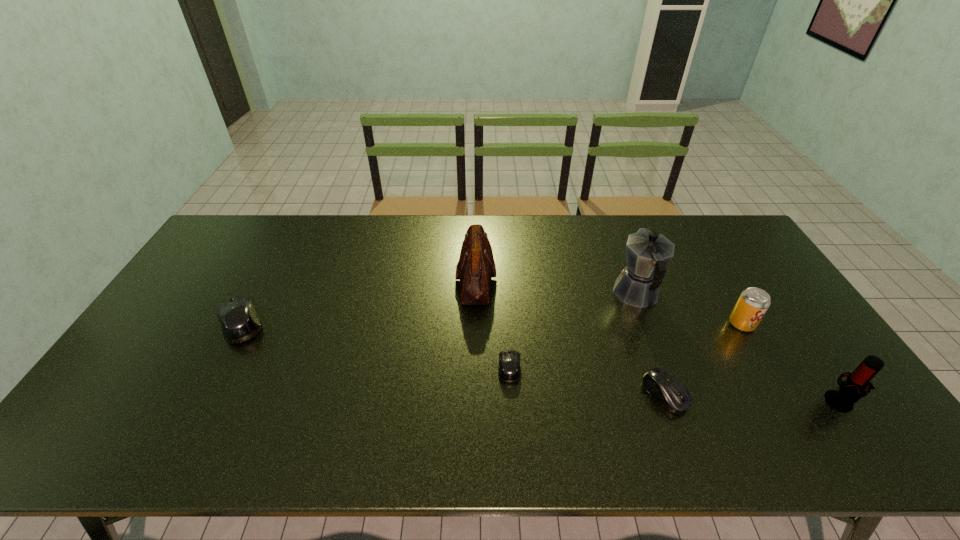
Where is `vacant space that satisfies the following two spatial constraints: 1. on the front side of the fifth shortest object; 2. on the left side of the fourth shortest object`? This screenshot has width=960, height=540. vacant space that satisfies the following two spatial constraints: 1. on the front side of the fifth shortest object; 2. on the left side of the fourth shortest object is located at coordinates [787, 401].